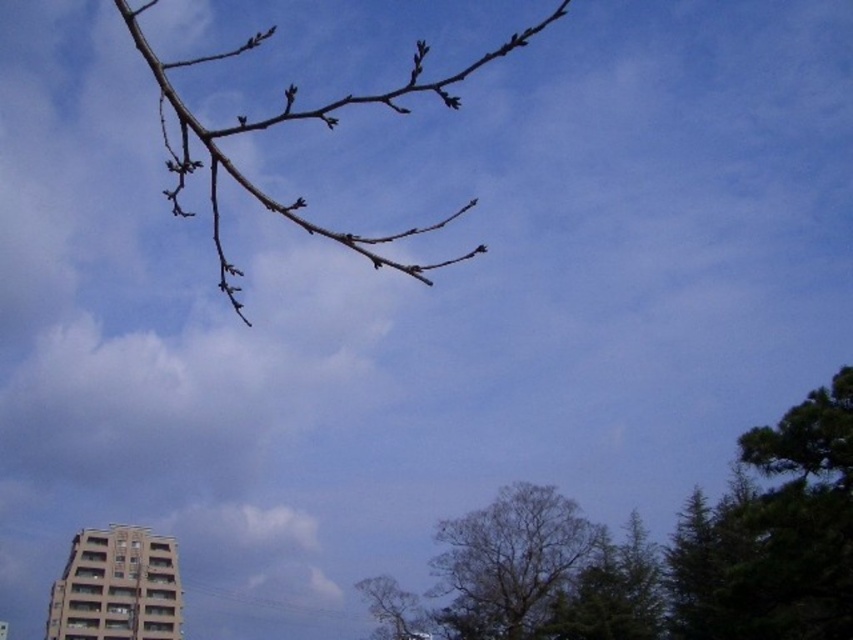
This screenshot has height=640, width=853. I want to click on green leafy tree at lower right, so click(x=659, y=554).

Is green leafy tree at lower right wider than bare branches at upper center?

Incorrect, green leafy tree at lower right's width does not surpass bare branches at upper center's.

Who is more distant from viewer, (434,589) or (263,124)?

The point (434,589) is behind.

The height and width of the screenshot is (640, 853). Find the location of `green leafy tree at lower right`. green leafy tree at lower right is located at coordinates (659, 554).

Can you confirm if brown textured tree at center is bigger than bare branches at upper center?

Incorrect, brown textured tree at center is not larger than bare branches at upper center.

This screenshot has width=853, height=640. What do you see at coordinates (509, 563) in the screenshot? I see `brown textured tree at center` at bounding box center [509, 563].

Between point (584, 545) and point (363, 253), which one is positioned in front?

Point (363, 253) is in front.

At what (x,y) coordinates should I click in order to perform the action: click on brown textured tree at center. Please return your answer as a coordinate pair (x, y). The width and height of the screenshot is (853, 640). Looking at the image, I should click on (509, 563).

Who is more distant from viewer, (790, 596) or (532, 572)?

The point (532, 572) is behind.

Between green leafy tree at lower right and brown textured tree at center, which one has less height?

brown textured tree at center is shorter.

Which is in front, point (437, 568) or point (430, 560)?

Point (437, 568) is more forward.

Find the location of a particular element. green leafy tree at lower right is located at coordinates (659, 554).